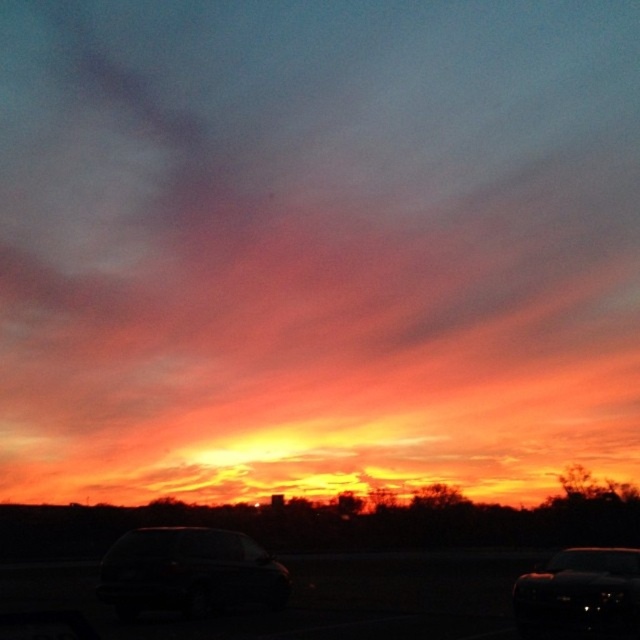
Is shiny black car at center shorter than glossy black car at lower right?

Indeed, shiny black car at center has a lesser height compared to glossy black car at lower right.

Between point (184, 605) and point (602, 576), which one is positioned behind?

Point (184, 605)

Locate an element on the screen. The width and height of the screenshot is (640, 640). shiny black car at center is located at coordinates (189, 572).

Looking at this image, can you confirm if glossy black car at lower right is shorter than transparent glass car window at lower right?

Correct, glossy black car at lower right is not as tall as transparent glass car window at lower right.

Describe the element at coordinates (579, 595) in the screenshot. I see `glossy black car at lower right` at that location.

Locate an element on the screen. glossy black car at lower right is located at coordinates (579, 595).

Is point (566, 554) behind point (198, 550)?

No, it is in front of (198, 550).

Which is above, glossy black car at lower right or transparent glass car window at lower center?

transparent glass car window at lower center is above.

Between point (563, 620) and point (208, 554), which one is positioned in front?

Point (563, 620)

At what (x,y) coordinates should I click in order to perform the action: click on glossy black car at lower right. Please return your answer as a coordinate pair (x, y). The height and width of the screenshot is (640, 640). Looking at the image, I should click on (579, 595).